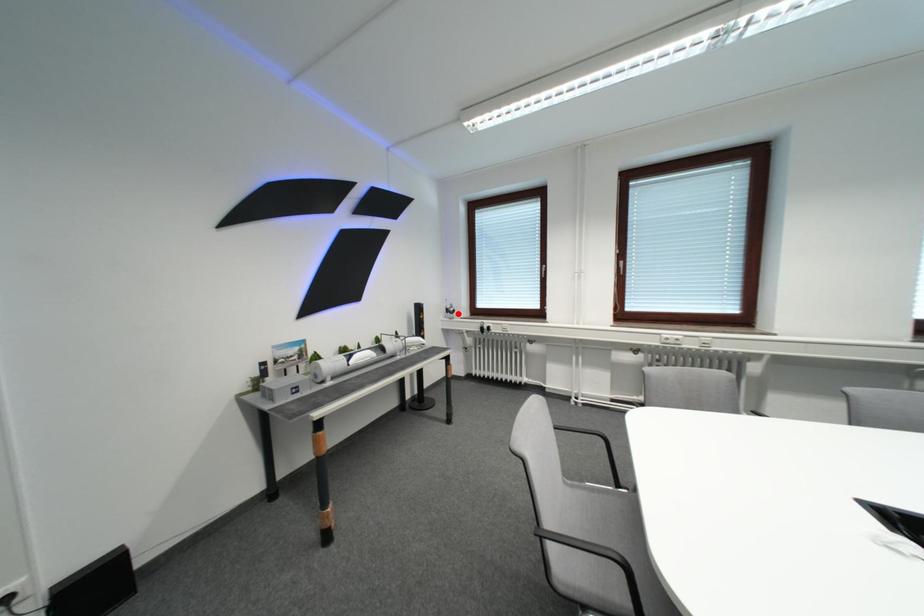
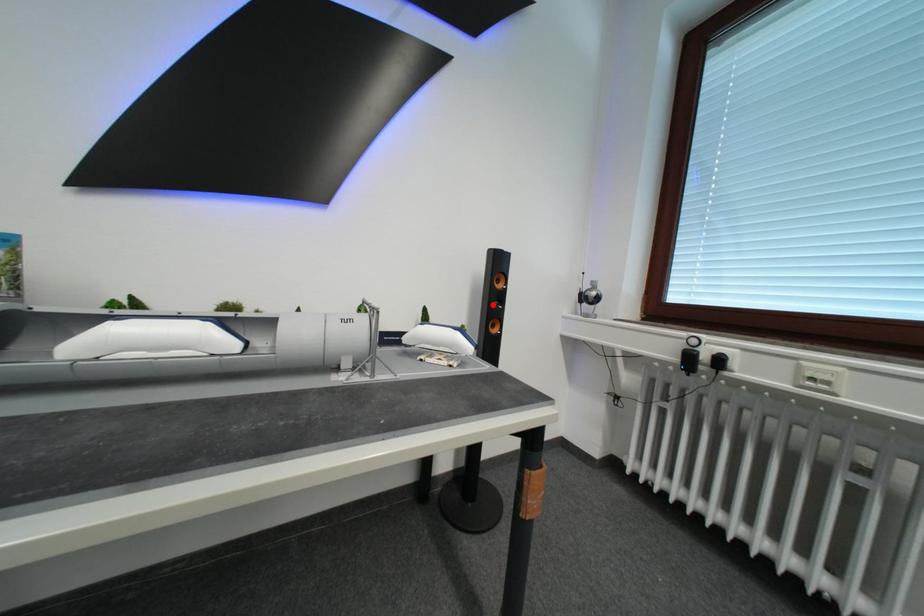
I am providing you with two images of the same scene from different viewpoints. A red point is marked on the first image and another point is marked on the second image. Is the marked point in image1 the same physical position as the marked point in image2?

No